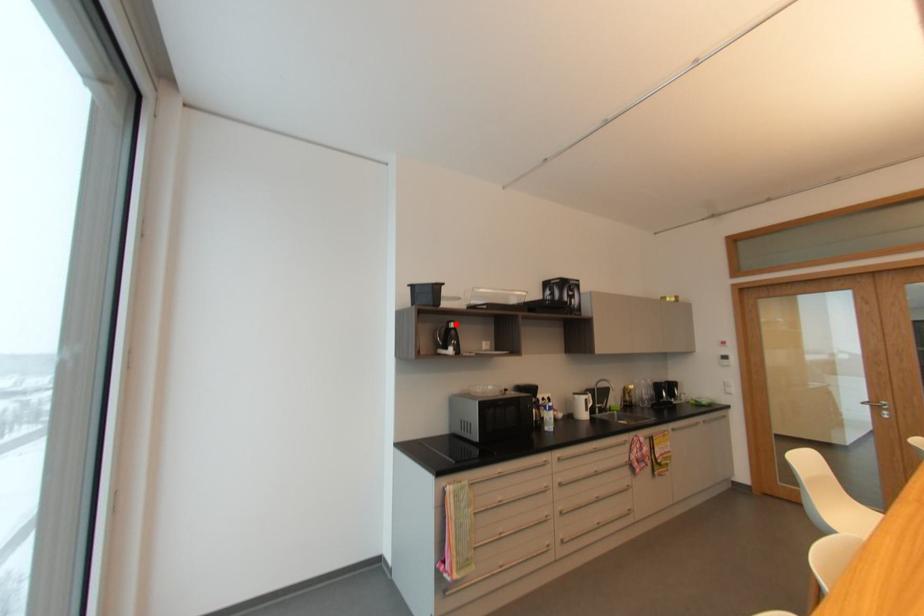
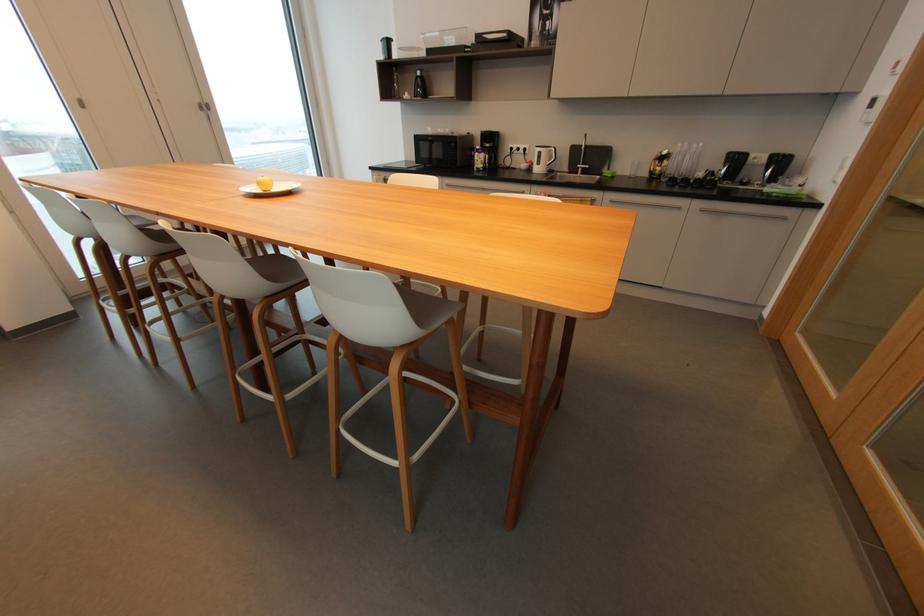
Question: I am providing you with two images of the same scene from different viewpoints. A red point is shown in image1. For the corresponding object point in image2, is it positioned nearer or farther from the camera?

Choices:
 (A) Nearer
 (B) Farther

Answer: (A)